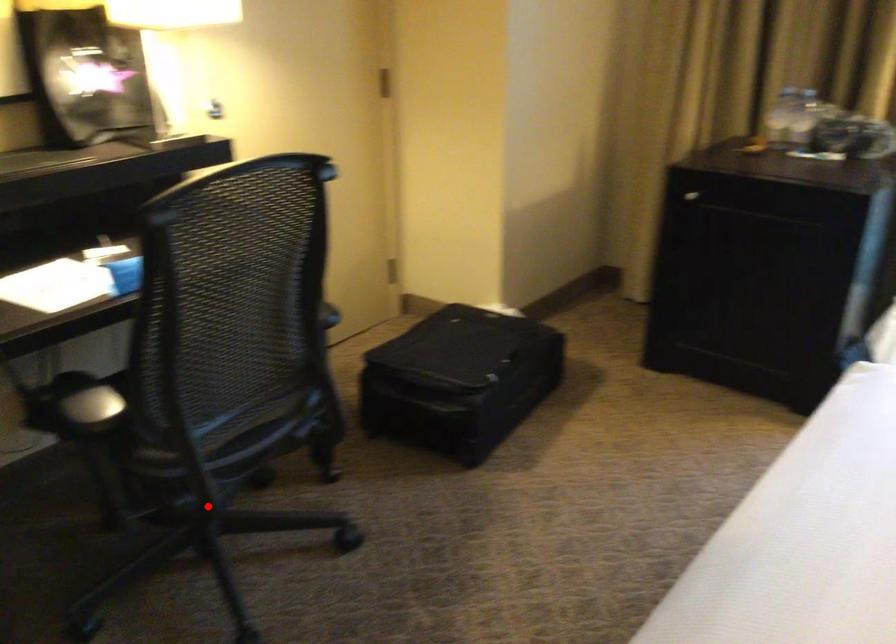
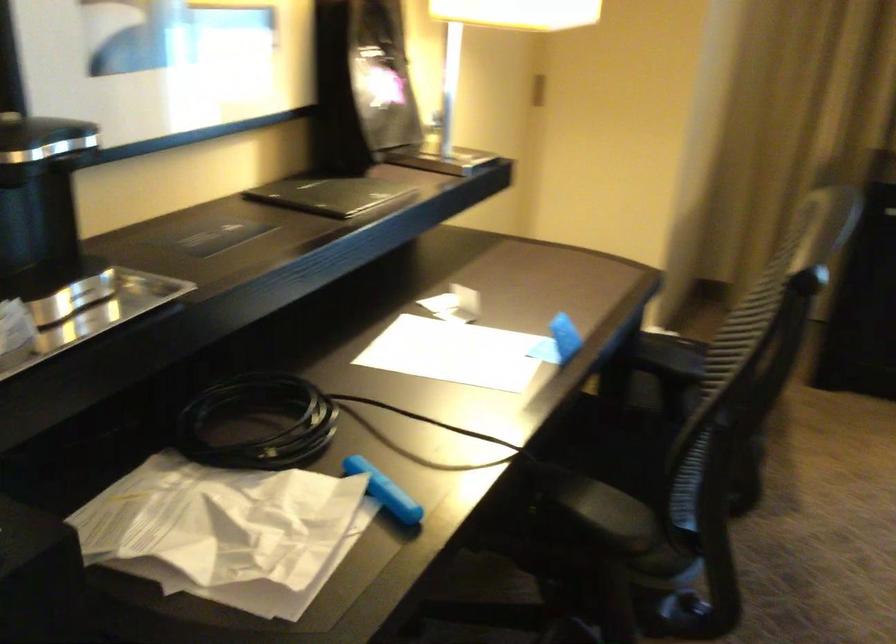
Question: I am providing you with two images of the same scene from different viewpoints. A red point is marked on the first image. At the location where the point appears in image 1, is it still visible in image 2?

Choices:
 (A) Yes
 (B) No

Answer: (A)